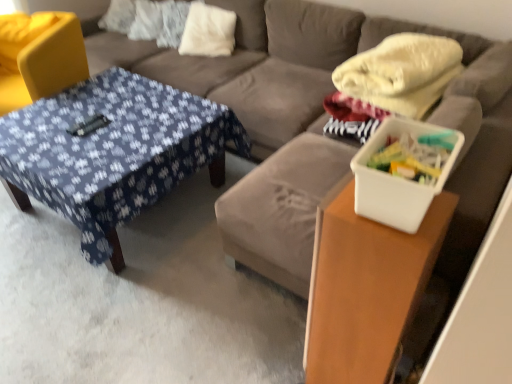
Question: Does point (414, 140) appear closer or farther from the camera than point (9, 34)?

Choices:
 (A) farther
 (B) closer

Answer: (B)

Question: From a real-world perspective, is white plastic container at right physically located above or below yellow fabric swivel chair at left?

Choices:
 (A) above
 (B) below

Answer: (A)

Question: Which object is the closest to the white soft pillow at upper center?

Choices:
 (A) blue fabric futon at center
 (B) yellow fabric swivel chair at left
 (C) white plastic container at right, the first table from the front
 (D) white plastic container at right
 (E) blue fabric-covered table at center, which is the 2th table in front-to-back order

Answer: (A)

Question: Which is nearer to the blue fabric futon at center?

Choices:
 (A) white soft pillow at upper center
 (B) yellow fabric swivel chair at left
 (C) white plastic container at right, the 1th table in the right-to-left sequence
 (D) blue fabric-covered table at center, placed as the 1th table when sorted from back to front
 (E) white plastic container at right

Answer: (A)